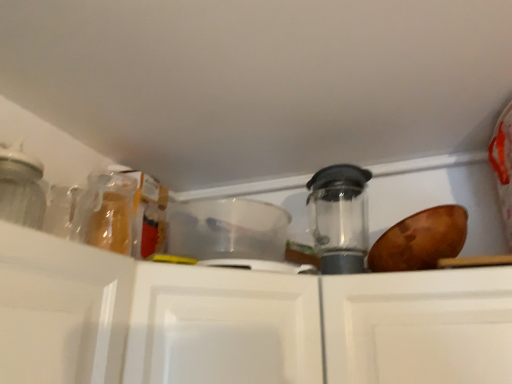
Question: Considering the positions of white matte cabinet at center and transparent plastic container at center, placed as the 2th appliance when sorted from right to left, in the image, is white matte cabinet at center bigger or smaller than transparent plastic container at center, placed as the 2th appliance when sorted from right to left,?

Choices:
 (A) small
 (B) big

Answer: (B)

Question: Looking at their shapes, would you say white matte cabinet at center is wider or thinner than transparent plastic container at center, placed as the first appliance when sorted from left to right?

Choices:
 (A) wide
 (B) thin

Answer: (A)

Question: Estimate the real-world distances between objects in this image. Which object is farther from the transparent plastic container at center, placed as the first appliance when sorted from left to right?

Choices:
 (A) white matte cabinet at center
 (B) transparent plastic blender at center, arranged as the second appliance when viewed from the left

Answer: (A)

Question: Which object is positioned closest to the transparent plastic container at center, placed as the 2th appliance when sorted from right to left?

Choices:
 (A) white matte cabinet at center
 (B) transparent plastic blender at center, positioned as the 1th appliance in right-to-left order

Answer: (B)